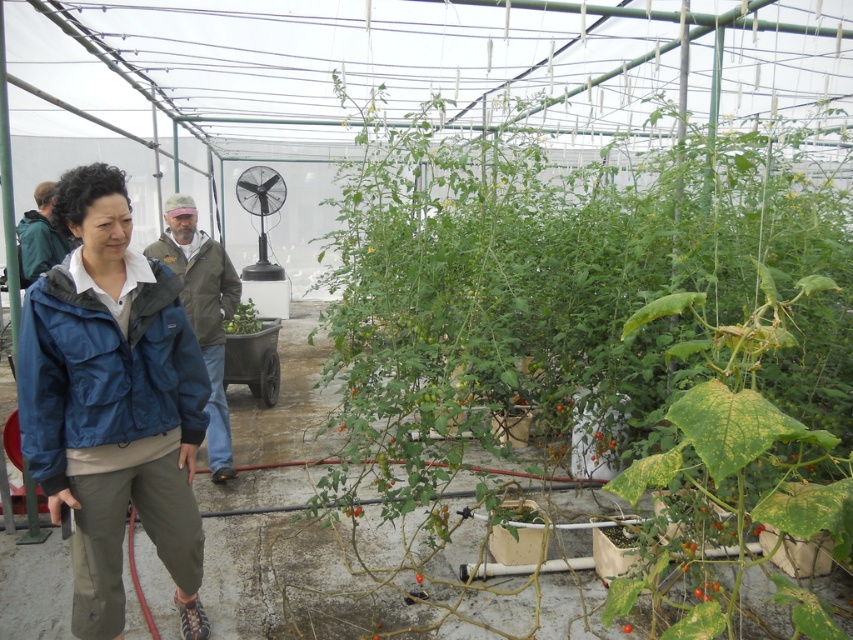
Question: Considering the relative positions of green matte jacket at left and red matte tomato at center in the image provided, where is green matte jacket at left located with respect to red matte tomato at center?

Choices:
 (A) right
 (B) left

Answer: (B)

Question: Estimate the real-world distances between objects in this image. Which object is closer to the green matte jacket at left?

Choices:
 (A) blue fabric jacket at left
 (B) green leafy plant at center
 (C) blue fabric jacket at center

Answer: (A)

Question: Does green leafy plant at center have a larger size compared to blue fabric jacket at left?

Choices:
 (A) no
 (B) yes

Answer: (B)

Question: Is blue fabric jacket at left further to camera compared to green matte jacket at left?

Choices:
 (A) no
 (B) yes

Answer: (A)

Question: Which of the following is the closest to the observer?

Choices:
 (A) green leafy plant at center
 (B) green matte plant at center
 (C) green matte tomato at center

Answer: (A)

Question: Considering the real-world distances, which object is closest to the blue fabric jacket at center?

Choices:
 (A) green matte plant at center
 (B) blue fabric jacket at left

Answer: (B)